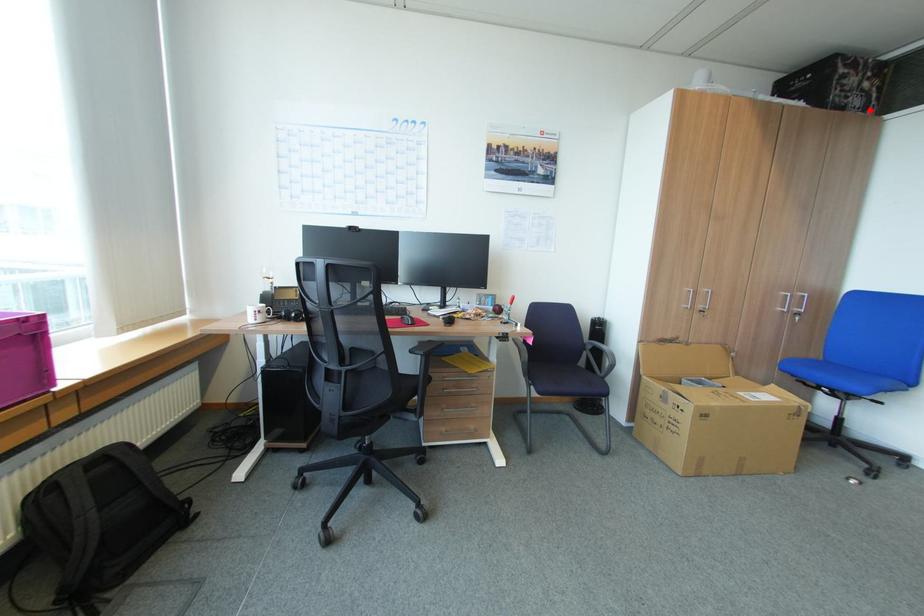
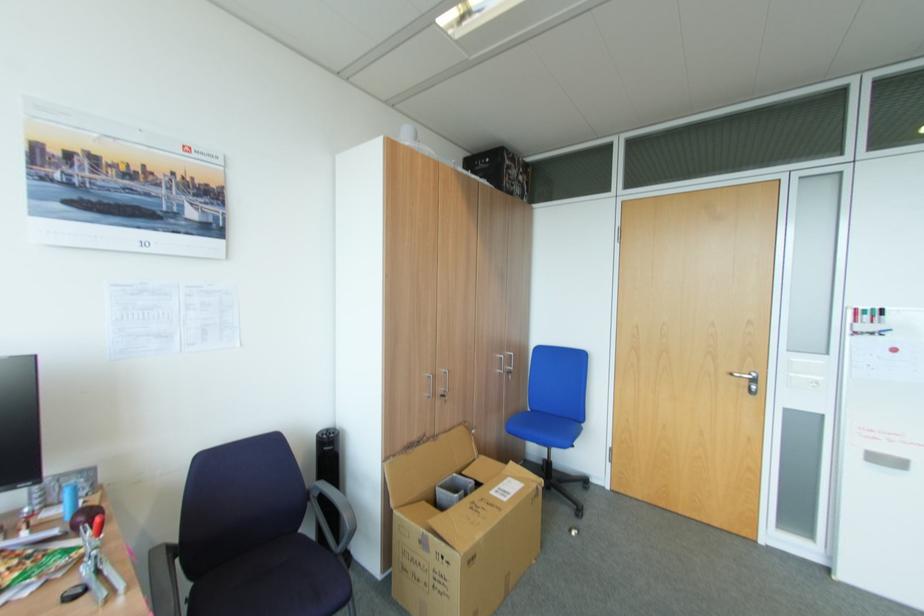
In the second image, find the point that corresponds to the highlighted location in the first image.

(528, 199)